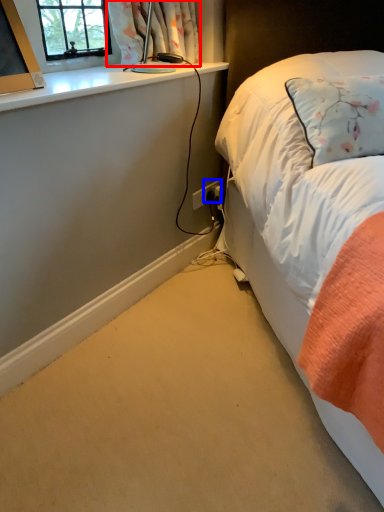
Question: Which object appears closest to the camera in this image, curtain (highlighted by a red box) or power plugs and sockets (highlighted by a blue box)?

Choices:
 (A) curtain
 (B) power plugs and sockets

Answer: (A)